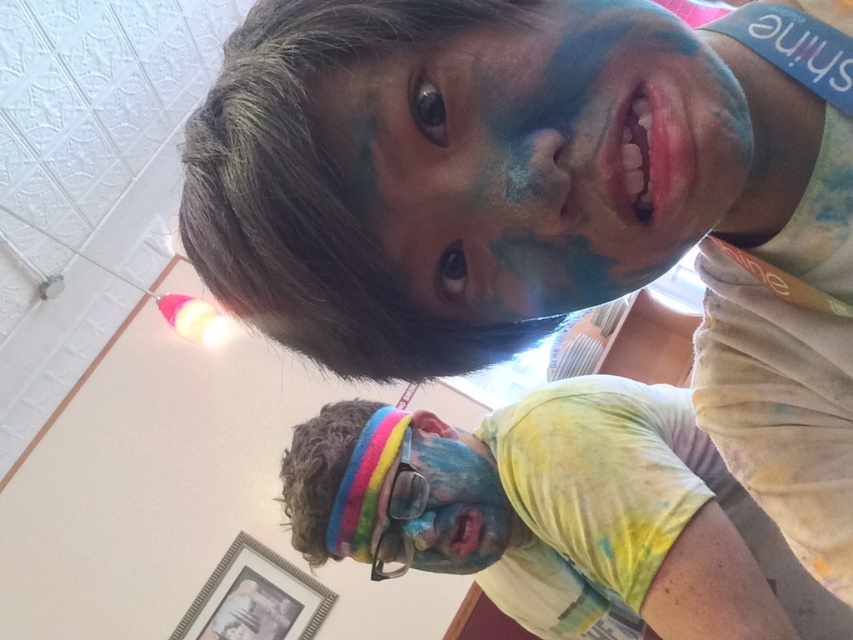
Question: Does blue matte face at upper center have a lesser width compared to matte multicolored face at lower center?

Choices:
 (A) yes
 (B) no

Answer: (B)

Question: Which object is positioned closest to the matte multicolored face at lower center?

Choices:
 (A) blue matte face at upper center
 (B) rainbow tie-dye shirt at lower right

Answer: (B)

Question: Can you confirm if blue matte face at upper center is smaller than matte multicolored face at lower center?

Choices:
 (A) no
 (B) yes

Answer: (B)

Question: Which of the following is the closest to the observer?

Choices:
 (A) (648, 212)
 (B) (741, 492)

Answer: (A)

Question: Which of these objects is positioned closest to the matte multicolored face at lower center?

Choices:
 (A) rainbow tie-dye shirt at lower right
 (B) blue matte face at upper center

Answer: (A)

Question: Is blue matte face at upper center further to the viewer compared to rainbow tie-dye shirt at lower right?

Choices:
 (A) yes
 (B) no

Answer: (B)